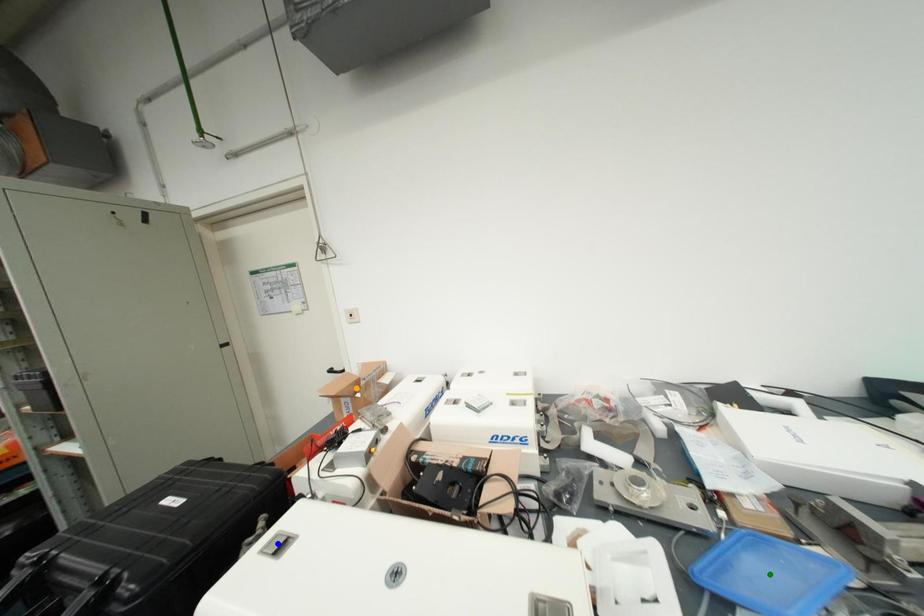
Order these from nearest to farthest:
- orange point
- green point
- blue point

1. green point
2. blue point
3. orange point